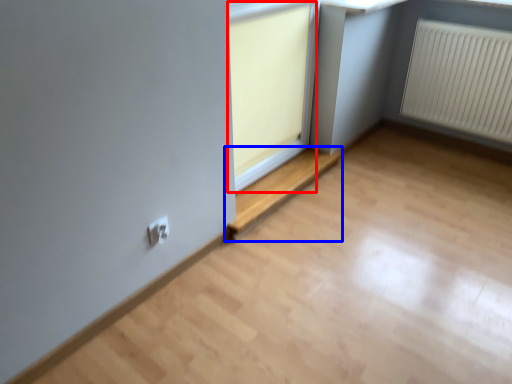
Question: Which point is closer to the camera, window frame (highlighted by a red box) or window (highlighted by a blue box)?

Choices:
 (A) window frame
 (B) window

Answer: (A)